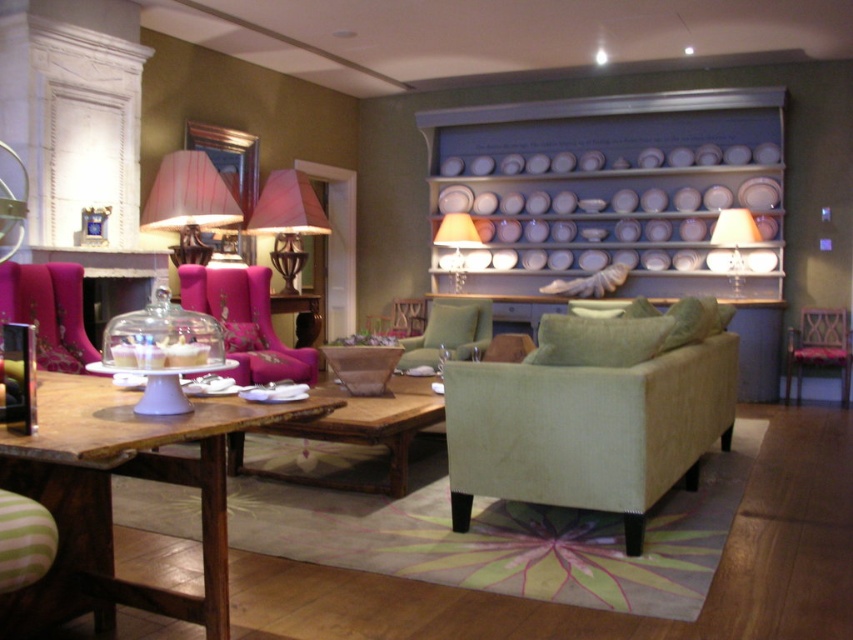
Consider the image. Who is positioned more to the right, wooden table at lower left or pink fabric armchair at right?

From the viewer's perspective, pink fabric armchair at right appears more on the right side.

Is wooden table at lower left above pink fabric armchair at right?

Incorrect, wooden table at lower left is not positioned above pink fabric armchair at right.

The image size is (853, 640). What are the coordinates of `wooden table at lower left` in the screenshot? It's located at (109, 493).

This screenshot has height=640, width=853. What do you see at coordinates (589, 419) in the screenshot? I see `light beige fabric couch at center` at bounding box center [589, 419].

Is light beige fabric couch at center closer to camera compared to matte white lampshade at upper center?

Yes, it is.

Describe the element at coordinates (589, 419) in the screenshot. I see `light beige fabric couch at center` at that location.

Identify the location of light beige fabric couch at center. The width and height of the screenshot is (853, 640). (589, 419).

Can you confirm if light beige fabric couch at center is smaller than velvet pink armchair at center?

Actually, light beige fabric couch at center might be larger than velvet pink armchair at center.

Does light beige fabric couch at center appear on the right side of velvet pink armchair at center?

Answer: Yes, light beige fabric couch at center is to the right of velvet pink armchair at center.

Does point (461, 401) come closer to viewer compared to point (306, 372)?

Yes, it is in front of point (306, 372).

In order to click on light beige fabric couch at center in this screenshot , I will do `click(589, 419)`.